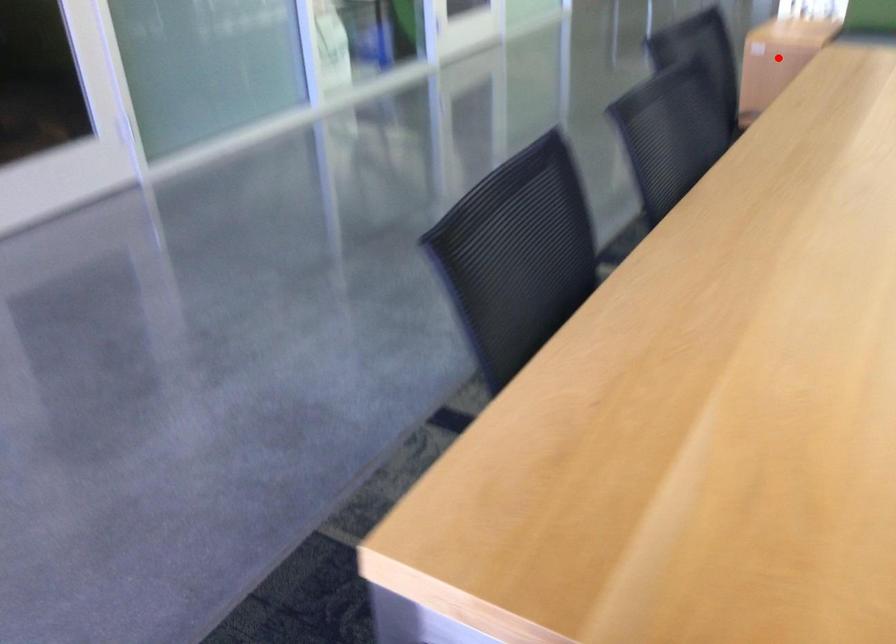
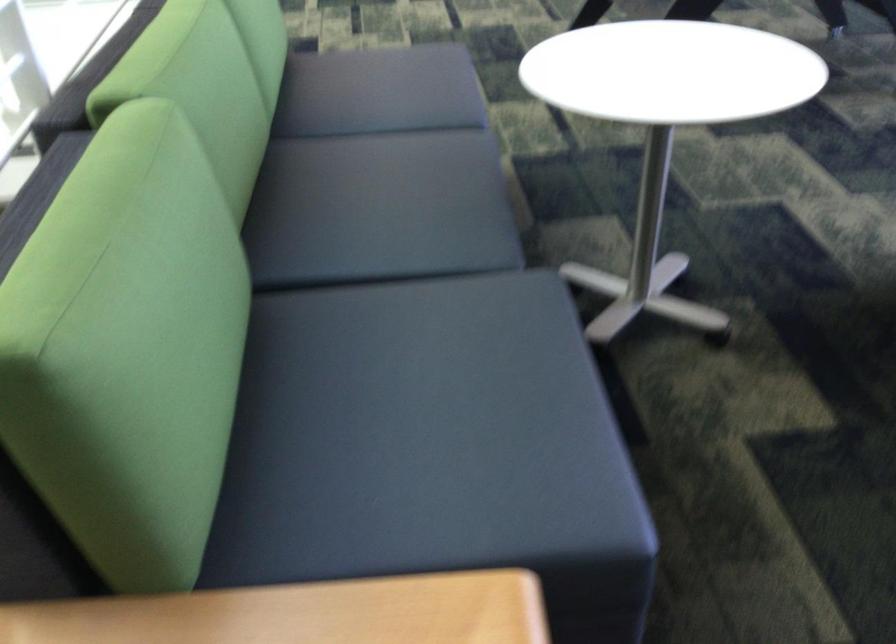
Question: I am providing you with two images of the same scene from different viewpoints. A red point is marked on the first image. Is the red point's position out of view in image 2?

Choices:
 (A) Yes
 (B) No

Answer: (A)